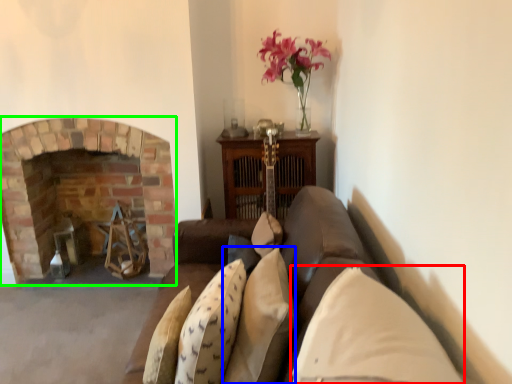
Question: Which object is the farthest from pillow (highlighted by a red box)? Choose among these: pillow (highlighted by a blue box) or fireplace (highlighted by a green box).

Choices:
 (A) pillow
 (B) fireplace

Answer: (B)